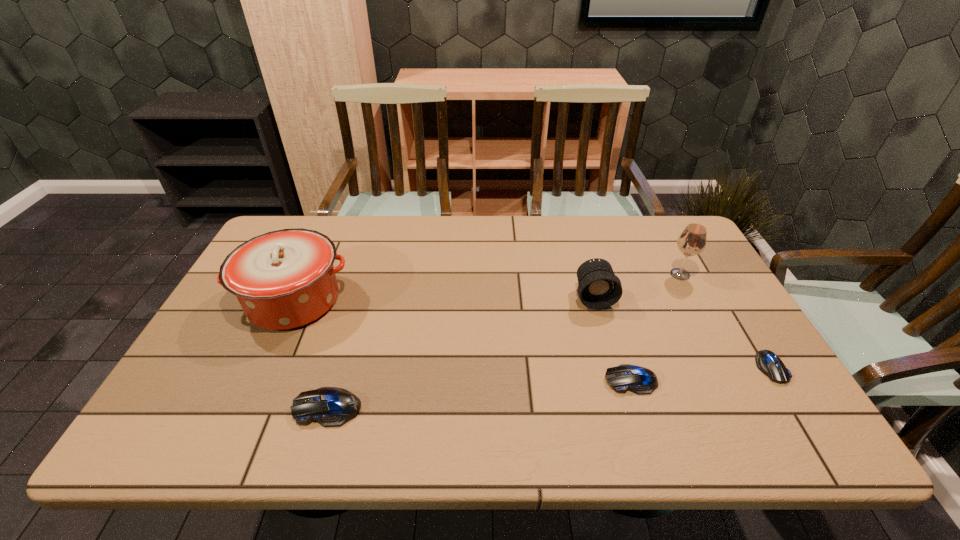
What are the coordinates of `wineglass that is at the right edge` in the screenshot? It's located at (692, 241).

I want to click on object located at the near right corner, so click(x=767, y=362).

You are a GUI agent. You are given a task and a screenshot of the screen. Output one action in this format:
    pyautogui.click(x=<x>, y=<y>)
    Task: Click on the vacant point at the far edge
    This screenshot has height=540, width=960.
    Given the screenshot: What is the action you would take?
    pyautogui.click(x=605, y=228)

In the image, there is a desktop. In order to click on vacant space at the near edge in this screenshot , I will do `click(266, 386)`.

Where is `free space at the left edge of the desktop`? Image resolution: width=960 pixels, height=540 pixels. free space at the left edge of the desktop is located at coordinates (239, 312).

Where is `blank space at the right edge`? The height and width of the screenshot is (540, 960). blank space at the right edge is located at coordinates (744, 332).

This screenshot has height=540, width=960. Identify the location of vacant space at the far left corner of the desktop. click(x=296, y=218).

Locate an element on the screen. This screenshot has height=540, width=960. free point at the far right corner is located at coordinates (668, 240).

You are a GUI agent. You are given a task and a screenshot of the screen. Output one action in this format:
    pyautogui.click(x=<x>, y=<y>)
    Task: Click on the free space between the telephoto lens and the casserole
    The height and width of the screenshot is (540, 960).
    Given the screenshot: What is the action you would take?
    pyautogui.click(x=444, y=299)

Where is `empty location between the tallest computer mouse and the casserole`? This screenshot has width=960, height=540. empty location between the tallest computer mouse and the casserole is located at coordinates coord(311,354).